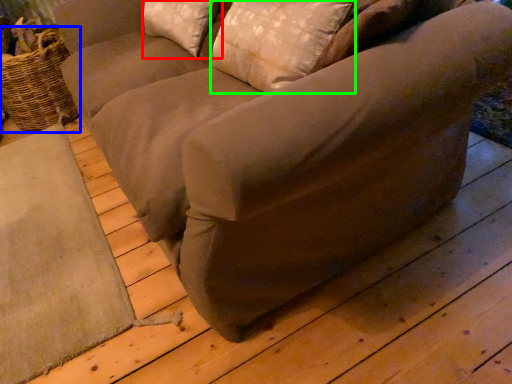
Question: Which object is positioned closest to pillow (highlighted by a red box)? Select from basket (highlighted by a blue box) and pillow (highlighted by a green box).

Choices:
 (A) basket
 (B) pillow

Answer: (B)